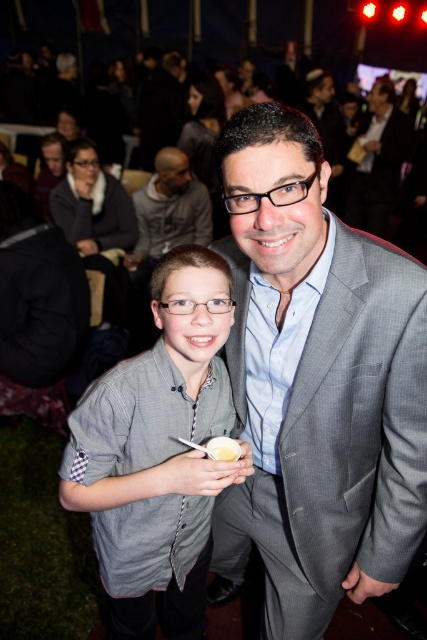
Who is positioned more to the left, gray suit at center or dark gray suit at upper center?

gray suit at center

Which of these two, gray suit at center or dark gray suit at upper center, stands taller?

With more height is dark gray suit at upper center.

Does point (310, 595) come behind point (350, 212)?

That is False.

Locate an element on the screen. This screenshot has width=427, height=640. gray suit at center is located at coordinates (315, 385).

Is dark gray suit at upper center wider than white creamy food at center?

Yes.

Does dark gray suit at upper center appear over white creamy food at center?

Indeed, dark gray suit at upper center is positioned over white creamy food at center.

The width and height of the screenshot is (427, 640). Find the location of `dark gray suit at upper center`. dark gray suit at upper center is located at coordinates (379, 161).

Locate an element on the screen. Image resolution: width=427 pixels, height=640 pixels. dark gray suit at upper center is located at coordinates (379, 161).

Which is more to the right, gray suit at center or gray striped shirt at center?

gray suit at center

What are the coordinates of `gray suit at center` in the screenshot? It's located at (315, 385).

This screenshot has height=640, width=427. In order to click on gray suit at center in this screenshot , I will do `click(315, 385)`.